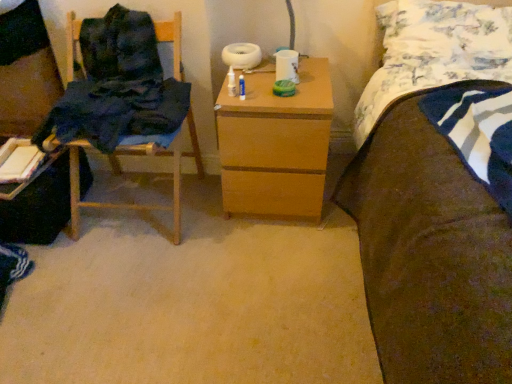
At what (x,y) coordinates should I click in order to perform the action: click on free space in front of wooden nightstand at center. Please return your answer as a coordinate pair (x, y). Looking at the image, I should click on (268, 260).